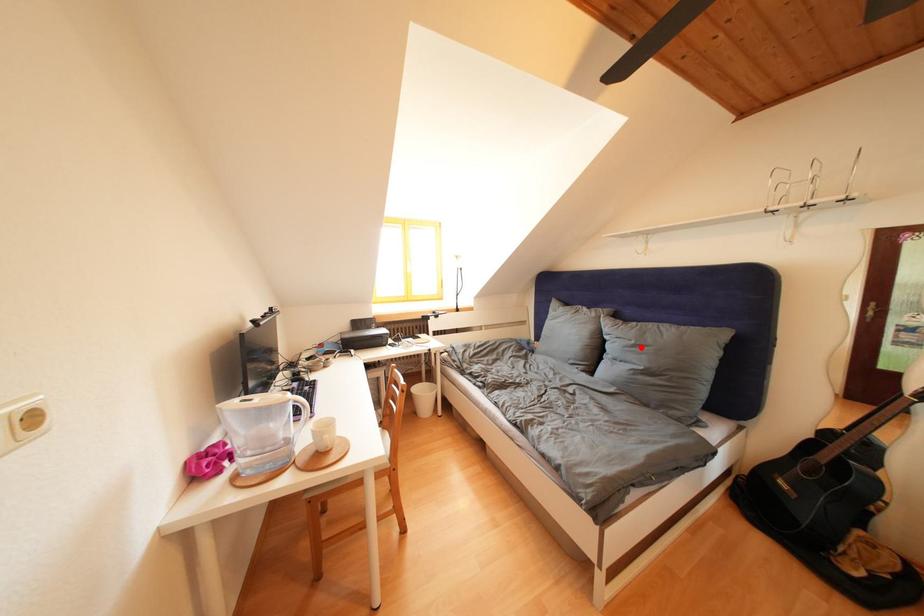
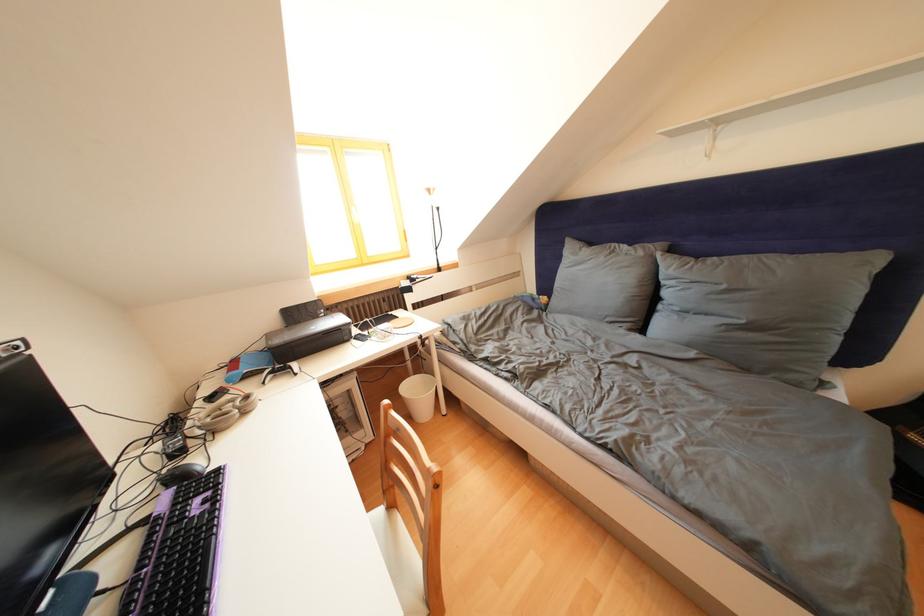
Find the pixel in the second image that matches the highlighted location in the first image.

(733, 292)